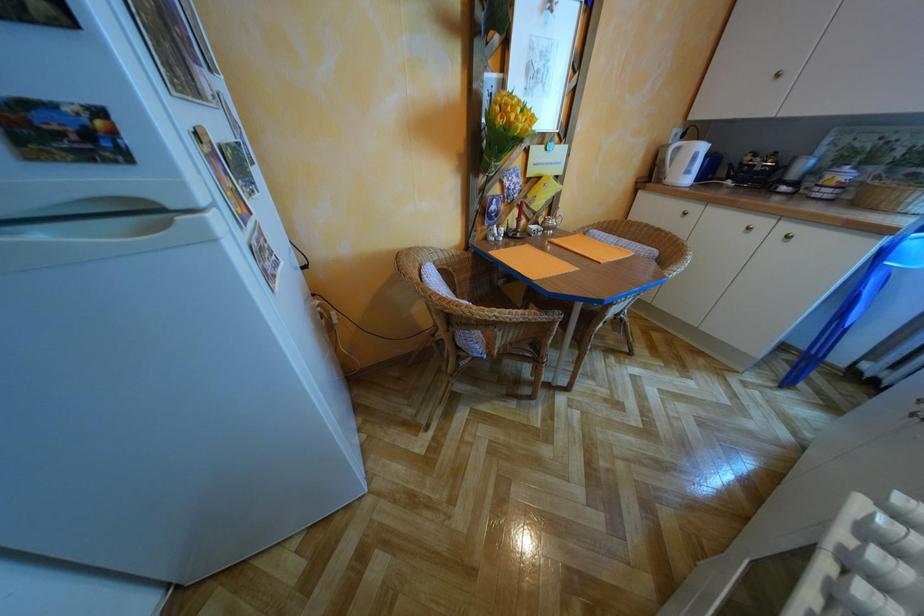
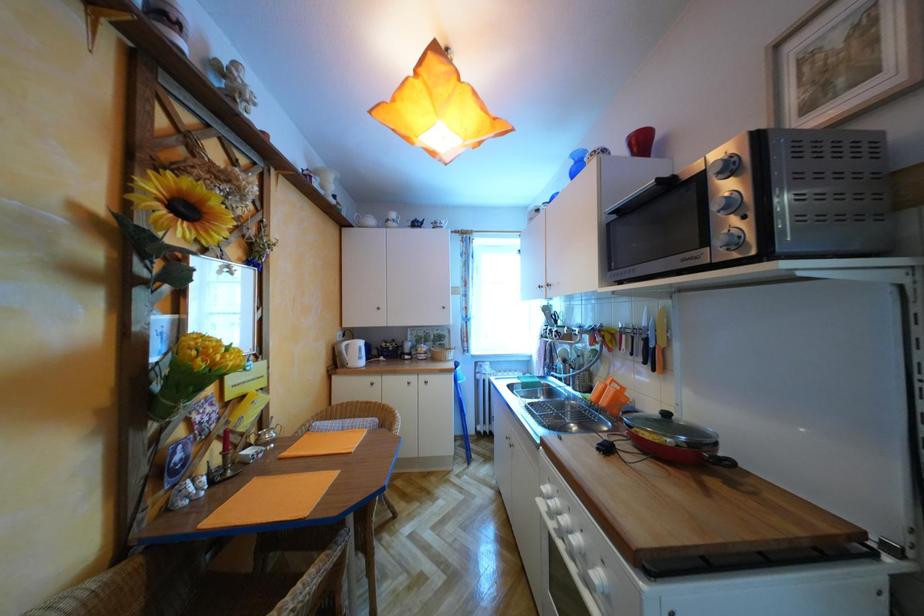
Question: Based on the continuous images, in which direction is the camera rotating? Reply with the corresponding letter.

Choices:
 (A) Left
 (B) Right
 (C) Up
 (D) Down

Answer: (B)